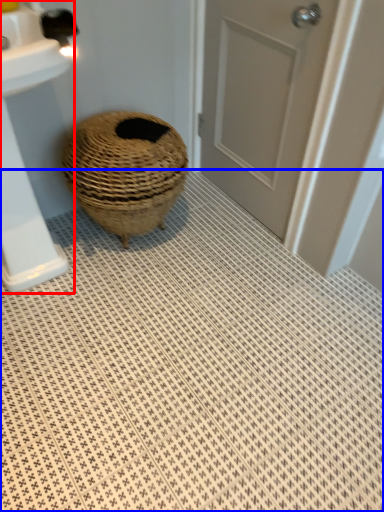
Question: Which of the following is the farthest to the observer, sink (highlighted by a red box) or bath mat (highlighted by a blue box)?

Choices:
 (A) sink
 (B) bath mat

Answer: (A)